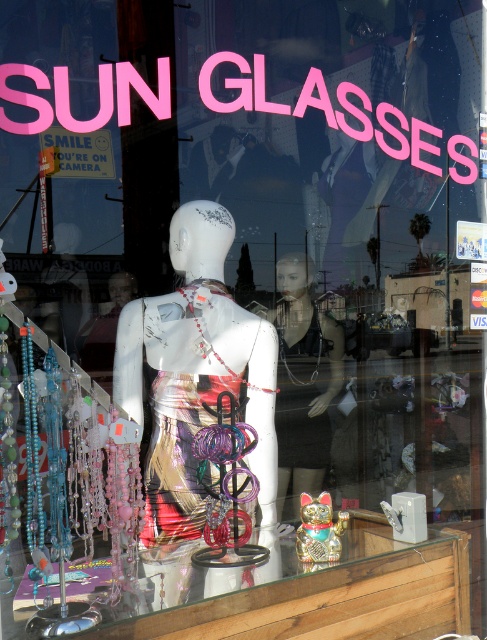
You are a delivery person who needs to place a large box in the storefront display. The box is as wide as the white glossy mannequin at center. Can you fit the box next to the metallic gold cat at center without moving any other items?

The white glossy mannequin at center is wider than the metallic gold cat at center. Since the box is as wide as the mannequin, it would be wider than the cat. However, without knowing the exact space available between them, it is uncertain if the box will fit. Check the available space between the two items before placing the box.

You are a customer entering the store and see the white glossy mannequin at center and the metallic gold cat at center. Which one is shorter?

The white glossy mannequin at center is shorter than the metallic gold cat at center.